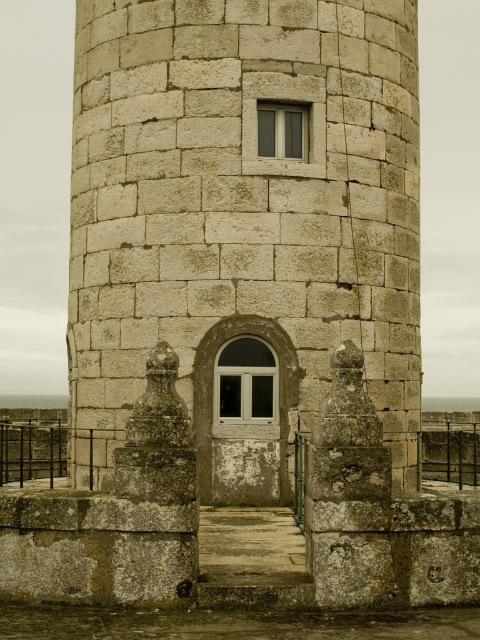
Is stone textured tower at center taller than matte glass window at upper center?

Indeed, stone textured tower at center has a greater height compared to matte glass window at upper center.

Where is `stone textured tower at center`? This screenshot has height=640, width=480. stone textured tower at center is located at coordinates (244, 212).

Does point (226, 8) come farther from viewer compared to point (294, 108)?

Yes.

Where is `stone textured tower at center`? The height and width of the screenshot is (640, 480). stone textured tower at center is located at coordinates (244, 212).

Measure the distance between white glass window at center and matte glass window at upper center.

white glass window at center is 4.35 meters away from matte glass window at upper center.

Can you confirm if white glass window at center is positioned to the left of matte glass window at upper center?

Correct, you'll find white glass window at center to the left of matte glass window at upper center.

Which is behind, point (238, 339) or point (273, 147)?

The point (273, 147) is more distant.

In order to click on white glass window at center in this screenshot , I will do `click(245, 388)`.

Is stone textured tower at center below white glass window at center?

Actually, stone textured tower at center is above white glass window at center.

How distant is stone textured tower at center from white glass window at center?

The distance of stone textured tower at center from white glass window at center is 2.64 meters.

You are a GUI agent. You are given a task and a screenshot of the screen. Output one action in this format:
    pyautogui.click(x=<x>, y=<y>)
    Task: Click on the stone textured tower at center
    The height and width of the screenshot is (640, 480).
    Given the screenshot: What is the action you would take?
    pyautogui.click(x=244, y=212)